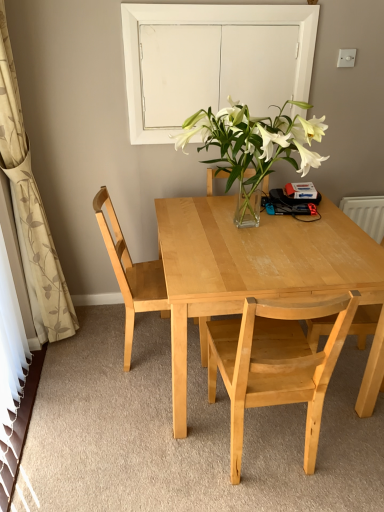
Identify the location of free spot below beige floral fabric curtain at left (from a real-world perspective). (64, 350).